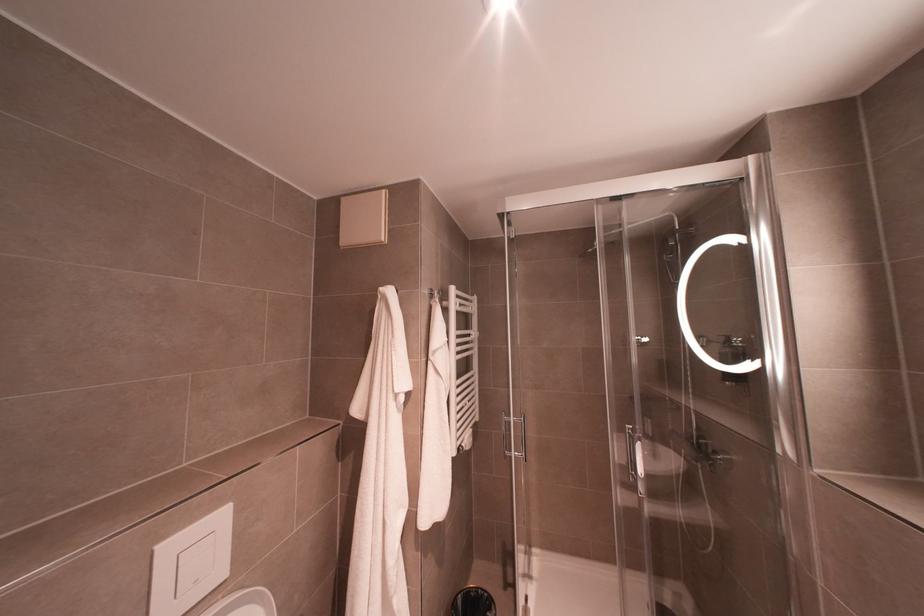
Describe the element at coordinates (505, 435) in the screenshot. The image size is (924, 616). I see `the metal shower handle` at that location.